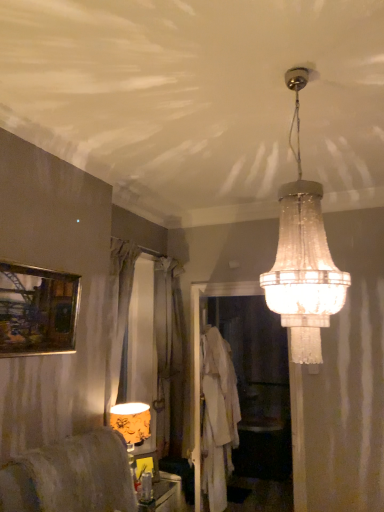
Question: From a real-world perspective, is clear glass chandelier at upper center, the 1th lamp when ordered from front to back, on top of translucent glass bottle at lower center, the 1th furniture positioned from the bottom?

Choices:
 (A) no
 (B) yes

Answer: (B)

Question: Is clear glass chandelier at upper center, marked as the second lamp in a left-to-right arrangement, positioned far away from translucent glass bottle at lower center, which is counted as the first furniture, starting from the back?

Choices:
 (A) no
 (B) yes

Answer: (B)

Question: From a real-world perspective, is clear glass chandelier at upper center, the 1th lamp in the right-to-left sequence, positioned under translucent glass bottle at lower center, which is counted as the first furniture, starting from the back, based on gravity?

Choices:
 (A) yes
 (B) no

Answer: (B)

Question: Is clear glass chandelier at upper center, marked as the second lamp in a left-to-right arrangement, closer to the viewer compared to translucent glass bottle at lower center, the 1th furniture positioned from the bottom?

Choices:
 (A) yes
 (B) no

Answer: (A)

Question: Is clear glass chandelier at upper center, which is counted as the second lamp, starting from the bottom, to the left of translucent glass bottle at lower center, arranged as the second furniture when viewed from the front, from the viewer's perspective?

Choices:
 (A) no
 (B) yes

Answer: (A)

Question: Considering the positions of yellow floral fabric lampshade at lower left, the 2th lamp viewed from the right, and matte gray fabric chair at lower left, the 1th furniture viewed from the top, in the image, is yellow floral fabric lampshade at lower left, the 2th lamp viewed from the right, taller or shorter than matte gray fabric chair at lower left, the 1th furniture viewed from the top,?

Choices:
 (A) tall
 (B) short

Answer: (A)

Question: Based on their sizes in the image, would you say yellow floral fabric lampshade at lower left, the 1th lamp viewed from the back, is bigger or smaller than matte gray fabric chair at lower left, arranged as the second furniture when ordered from the bottom?

Choices:
 (A) big
 (B) small

Answer: (B)

Question: Is point (145, 412) closer or farther from the camera than point (92, 445)?

Choices:
 (A) farther
 (B) closer

Answer: (A)

Question: In the image, is yellow floral fabric lampshade at lower left, the 1th lamp viewed from the back, positioned in front of or behind matte gray fabric chair at lower left, which is counted as the first furniture, starting from the front?

Choices:
 (A) behind
 (B) front

Answer: (A)

Question: Is clear glass chandelier at upper center, which appears as the 2th lamp when viewed from the back, wider or thinner than yellow floral fabric lampshade at lower left, the 2th lamp viewed from the right?

Choices:
 (A) wide
 (B) thin

Answer: (A)

Question: Is clear glass chandelier at upper center, which appears as the 2th lamp when viewed from the back, in front of or behind yellow floral fabric lampshade at lower left, the 1th lamp when ordered from bottom to top, in the image?

Choices:
 (A) behind
 (B) front

Answer: (B)

Question: From the image's perspective, relative to yellow floral fabric lampshade at lower left, the 2th lamp viewed from the right, is clear glass chandelier at upper center, the first lamp positioned from the top, above or below?

Choices:
 (A) above
 (B) below

Answer: (A)

Question: Is clear glass chandelier at upper center, which is counted as the second lamp, starting from the bottom, taller or shorter than yellow floral fabric lampshade at lower left, the 1th lamp viewed from the back?

Choices:
 (A) tall
 (B) short

Answer: (A)

Question: Is point (129, 414) positioned closer to the camera than point (316, 261)?

Choices:
 (A) farther
 (B) closer

Answer: (A)

Question: Is yellow floral fabric lampshade at lower left, the 1th lamp when ordered from bottom to top, taller or shorter than clear glass chandelier at upper center, the 1th lamp when ordered from front to back?

Choices:
 (A) short
 (B) tall

Answer: (A)